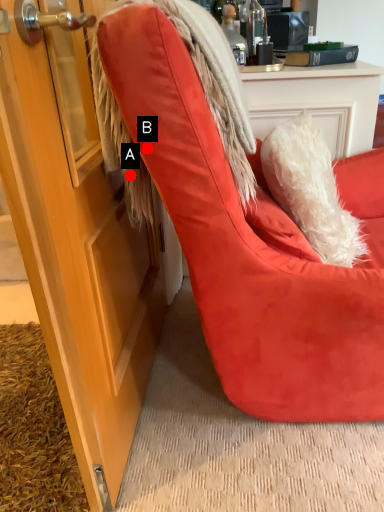
Question: Two points are circled on the image, labeled by A and B beside each circle. Which of the following is the farthest from the observer?

Choices:
 (A) A is further
 (B) B is further

Answer: (A)